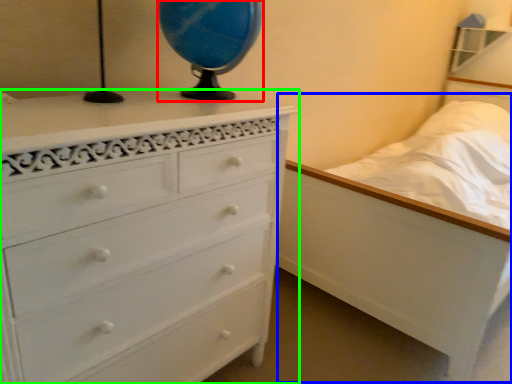
Question: Considering the real-world distances, which object is farthest from table lamp (highlighted by a red box)? bed (highlighted by a blue box) or chest of drawers (highlighted by a green box)?

Choices:
 (A) bed
 (B) chest of drawers

Answer: (A)